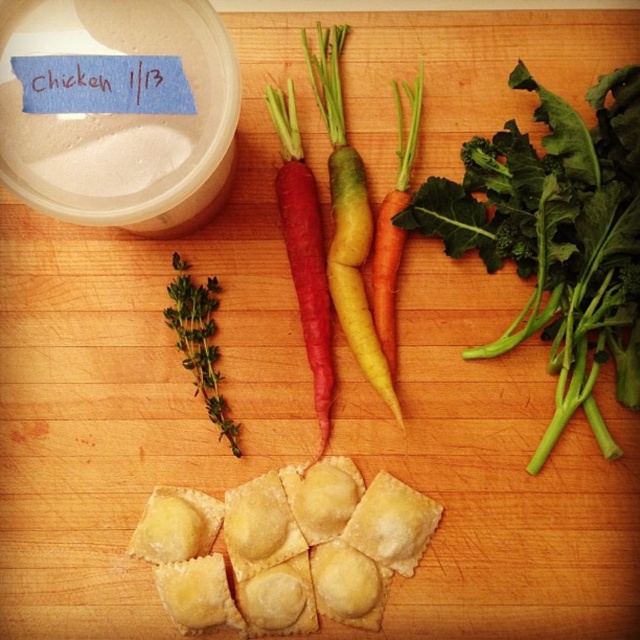
Question: Estimate the real-world distances between objects in this image. Which object is closer to the green leafy vegetable at upper right?

Choices:
 (A) yellow matte carrot at center
 (B) golden doughy ravioli at center
 (C) orange matte carrot at center
 (D) green herb at center

Answer: (C)

Question: From the image, what is the correct spatial relationship of golden doughy ravioli at center in relation to green herb at center?

Choices:
 (A) right
 (B) left

Answer: (A)

Question: Which point is closer to the camera?

Choices:
 (A) (333, 141)
 (B) (324, 358)
 (C) (500, 193)

Answer: (C)

Question: Is yellow matte carrot at center thinner than orange matte carrot at center?

Choices:
 (A) yes
 (B) no

Answer: (B)

Question: Does golden doughy ravioli at center come in front of orange matte carrot at center?

Choices:
 (A) yes
 (B) no

Answer: (A)

Question: Which point is closer to the camera?

Choices:
 (A) yellow matte carrot at center
 (B) green leafy vegetable at upper right

Answer: (B)